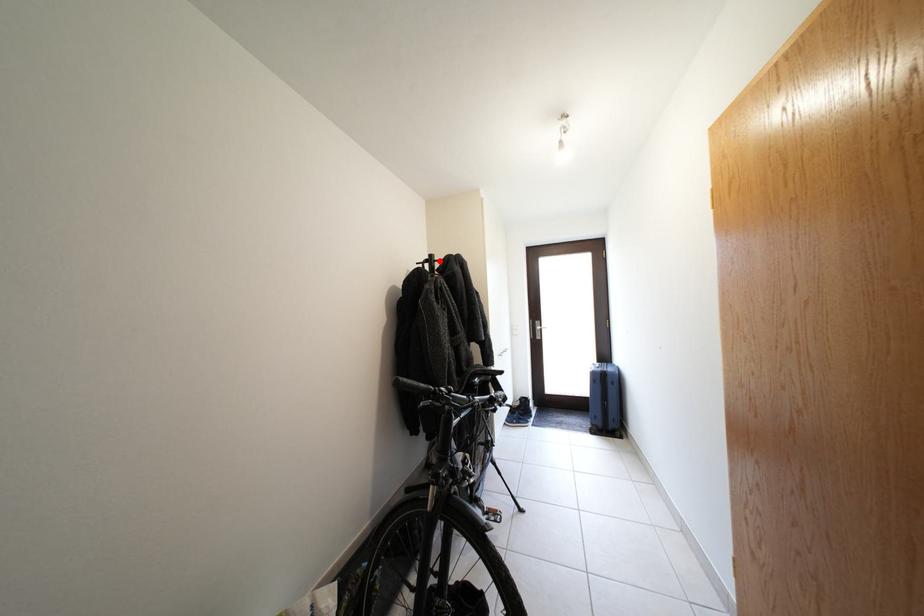
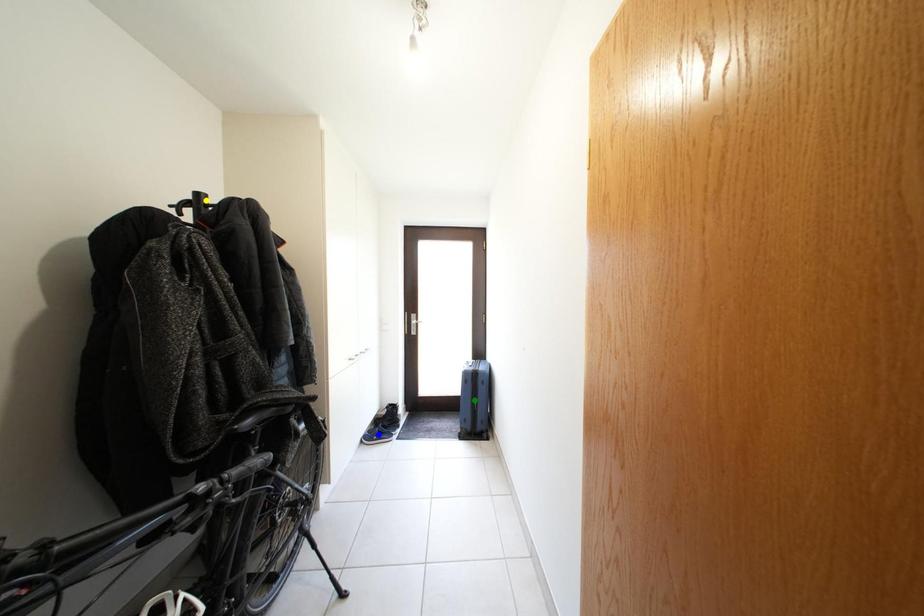
Question: I am providing you with two images of the same scene from different viewpoints. A red point is marked on the first image. You are given multiple points on the second image. Which point in image 2 represents the same 3d spot as the red point in image 1?

Choices:
 (A) blue point
 (B) yellow point
 (C) green point

Answer: (B)